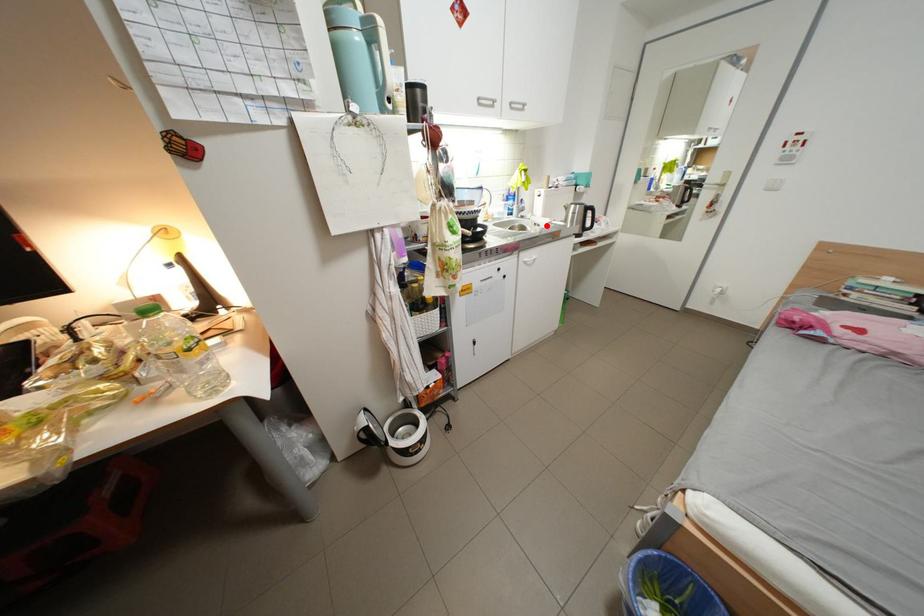
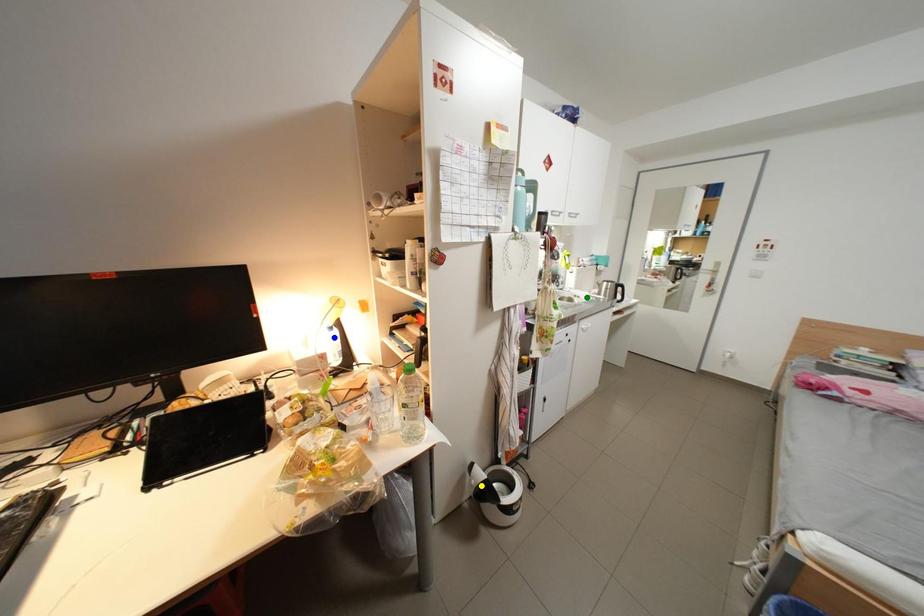
Question: I am providing you with two images of the same scene from different viewpoints. A red point is marked on the first image. You are given multiple points on the second image. Which mark in image 2 goes with the point in image 1?

Choices:
 (A) yellow point
 (B) green point
 (C) blue point

Answer: (B)